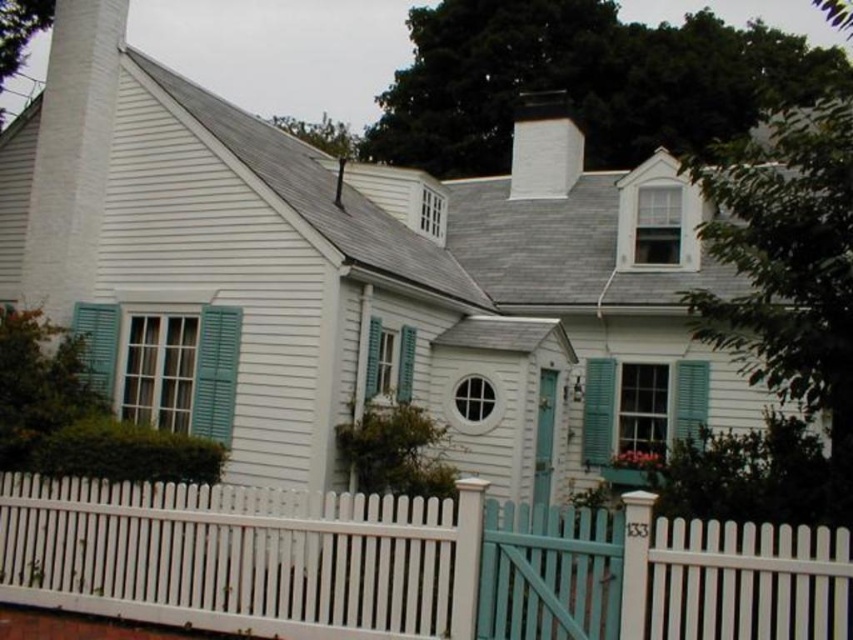
Is point (589, 422) behind point (706, 387)?

Yes.

Which is below, green matte shutter at center or teal matte shutter at center?

green matte shutter at center is lower down.

Which is in front, point (602, 378) or point (672, 419)?

Point (672, 419) is more forward.

Image resolution: width=853 pixels, height=640 pixels. What are the coordinates of `green matte shutter at center` in the screenshot? It's located at (598, 410).

Can you confirm if teal painted wood shutter at left is positioned below green matte shutter at center?

Actually, teal painted wood shutter at left is above green matte shutter at center.

Does teal painted wood shutter at left lie behind green matte shutter at center?

No, it is in front of green matte shutter at center.

Identify the location of teal painted wood shutter at left. (184, 371).

Based on the photo, who is more distant from viewer, (167,356) or (706,369)?

The point (706,369) is more distant.

Is teal painted wood shutter at left above teal matte shutter at center?

Yes, teal painted wood shutter at left is above teal matte shutter at center.

Between point (178, 404) and point (682, 412), which one is positioned behind?

Point (682, 412)

Where is `teal painted wood shutter at left`? The width and height of the screenshot is (853, 640). teal painted wood shutter at left is located at coordinates (184, 371).